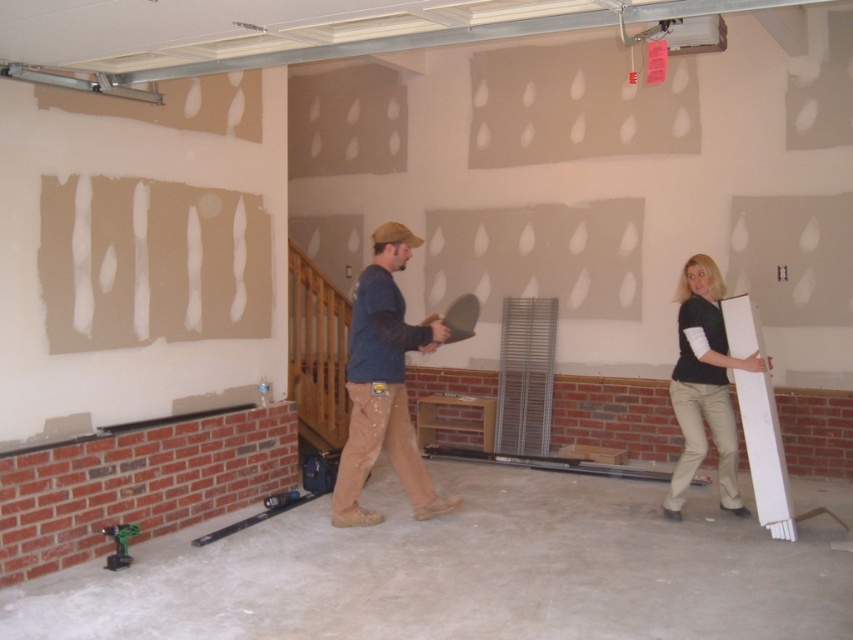
You are an inspector in the construction site. You see the matte blue shirt at center and the white matte board at center. Which object is closer to you?

The matte blue shirt at center is closer to you because it is in front of the white matte board at center.

You are an inspector checking the construction site. You notice the matte blue shirt at center and the white matte board at center. Which object is positioned higher in the image?

The matte blue shirt at center is above the white matte board at center, so it is positioned higher in the image.